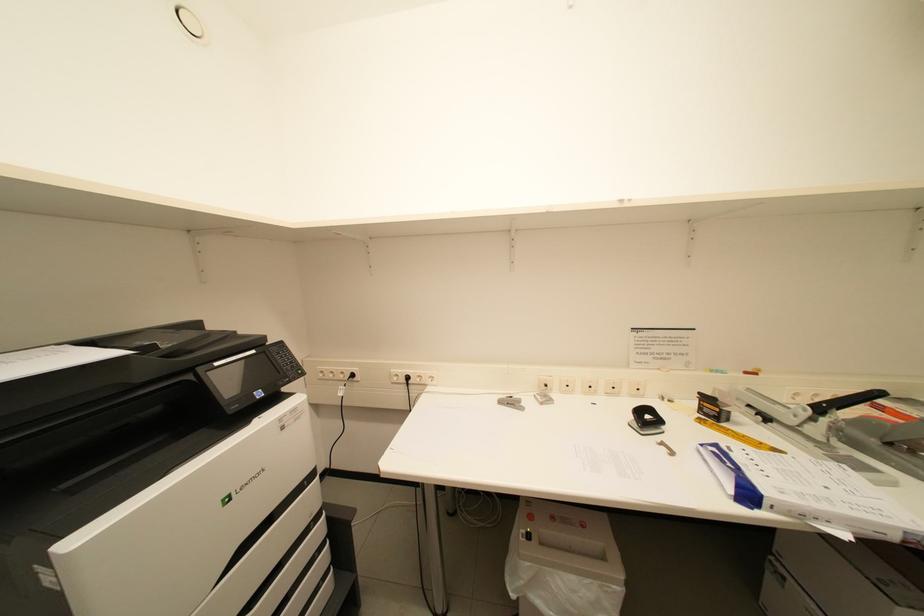
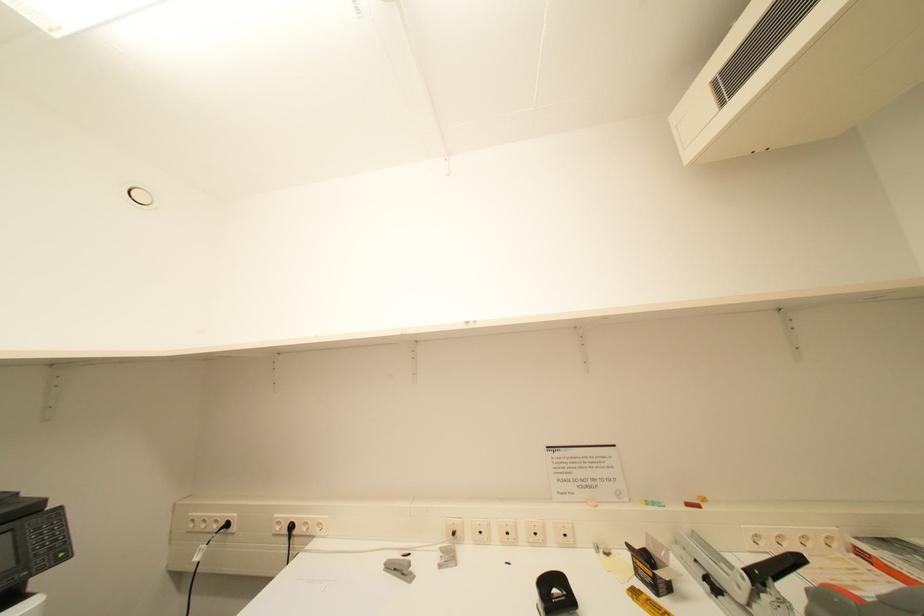
Question: The images are taken continuously from a first-person perspective. In which direction are you moving?

Choices:
 (A) Left
 (B) Right
 (C) Forward
 (D) Backward

Answer: (B)